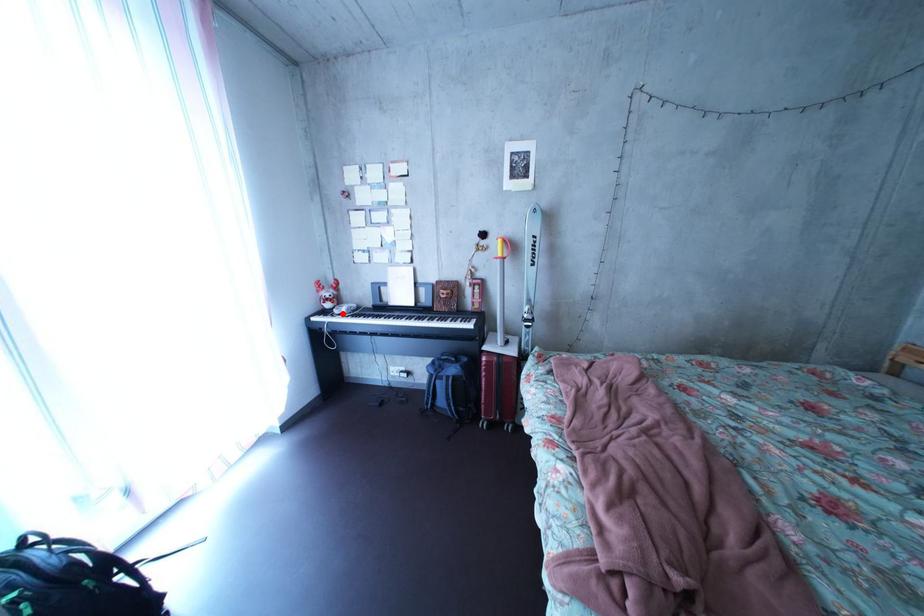
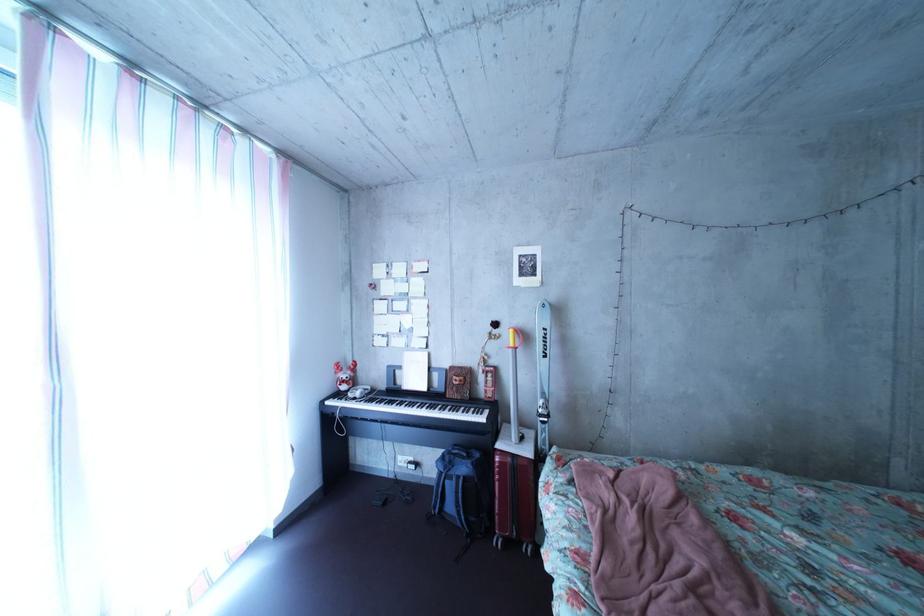
Where in the second image is the point corresponding to the highlighted location from the first image?

(358, 395)